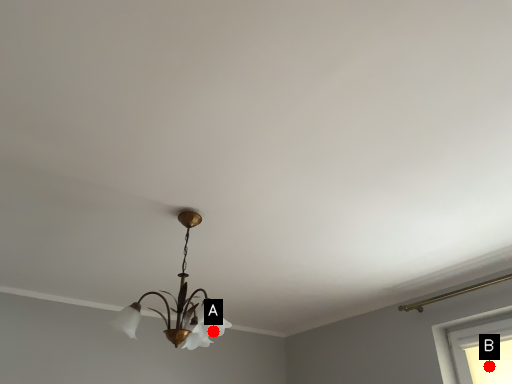
Question: Two points are circled on the image, labeled by A and B beside each circle. Among these points, which one is nearest to the camera?

Choices:
 (A) A is closer
 (B) B is closer

Answer: (B)